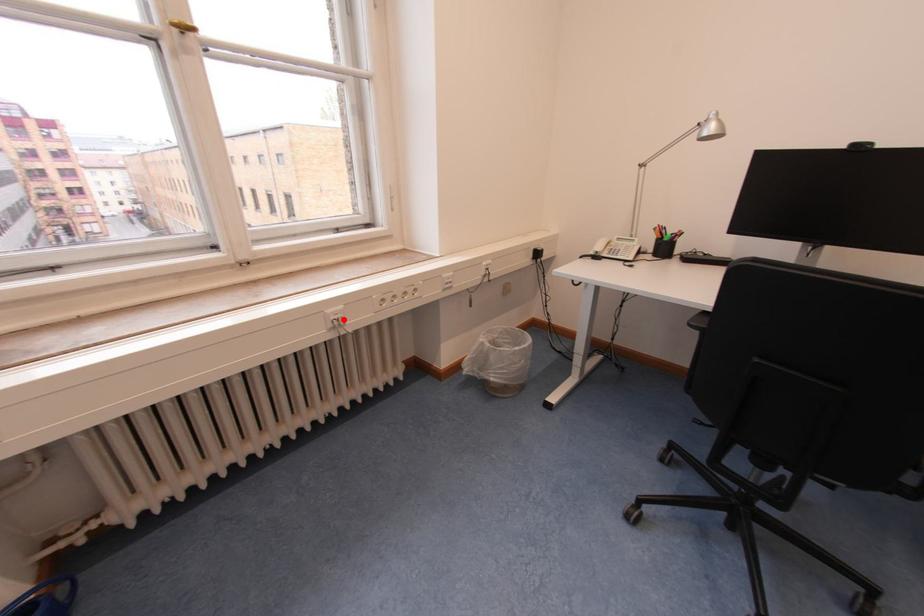
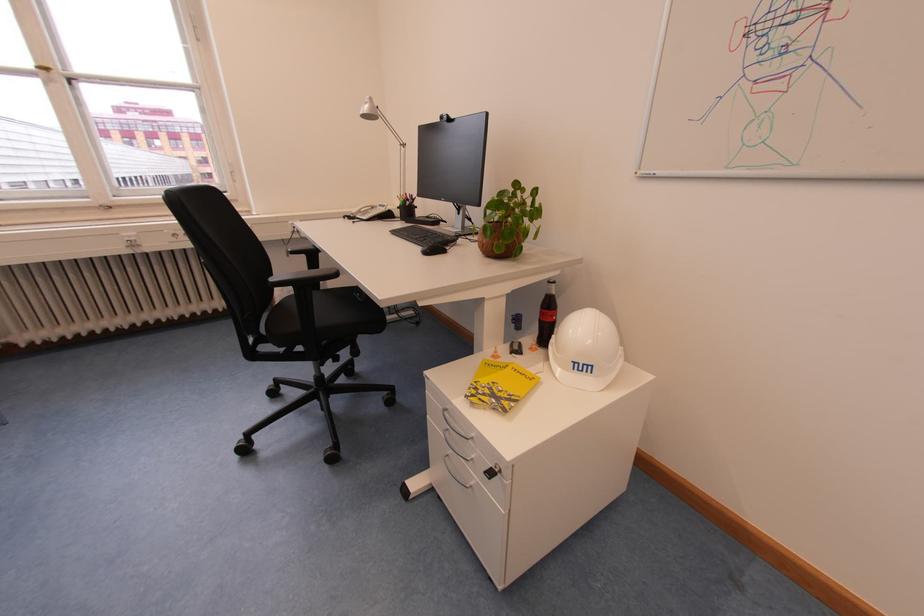
Locate, in the second image, the point that corresponds to the highlighted location in the first image.

(138, 241)